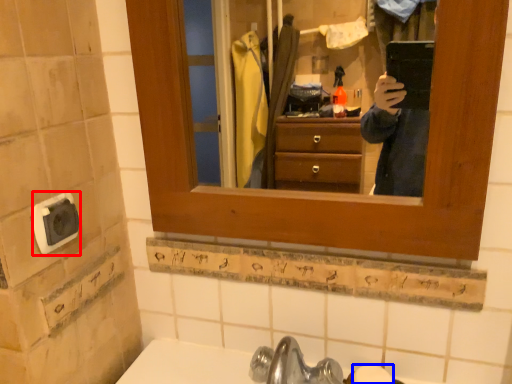
Question: Among these objects, which one is nearest to the camera, knob (highlighted by a red box) or soap (highlighted by a blue box)?

Choices:
 (A) knob
 (B) soap

Answer: (A)